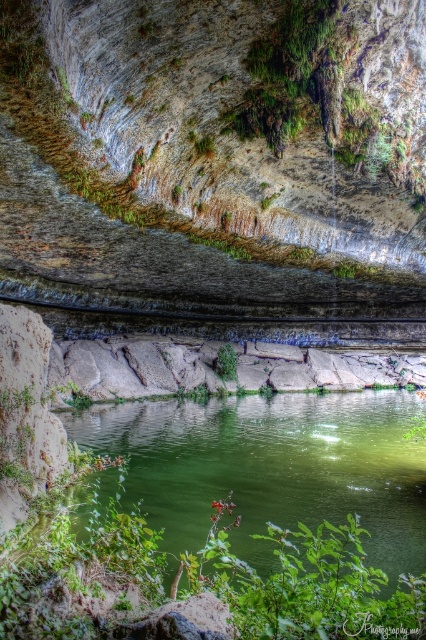
Image resolution: width=426 pixels, height=640 pixels. I want to click on green smooth water at center, so click(271, 467).

You are a GUI agent. You are given a task and a screenshot of the screen. Output one action in this format:
    pyautogui.click(x=<x>, y=<y>)
    Task: Click on the green smooth water at center
    The image size is (426, 640).
    Given the screenshot: What is the action you would take?
    pyautogui.click(x=271, y=467)

In the scene shown: Is green mossy rock at upper center below green leafy plant at center?

No.

I want to click on green mossy rock at upper center, so click(290, 76).

Image resolution: width=426 pixels, height=640 pixels. In order to click on green mossy rock at upper center in this screenshot , I will do `click(290, 76)`.

Between green smooth water at center and green mossy rock at upper center, which one has less height?

With less height is green smooth water at center.

The width and height of the screenshot is (426, 640). Describe the element at coordinates (271, 467) in the screenshot. I see `green smooth water at center` at that location.

What are the coordinates of `green smooth water at center` in the screenshot? It's located at (271, 467).